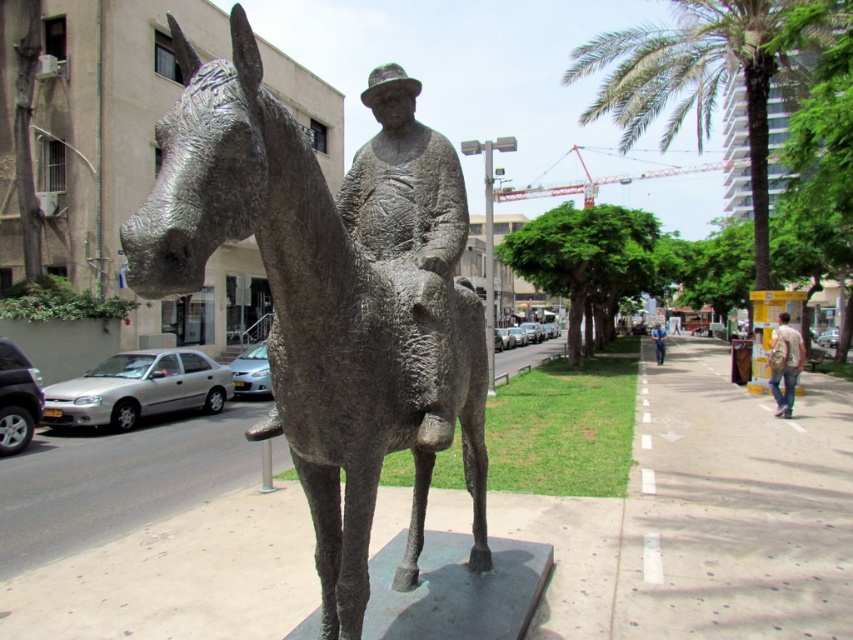
You are a city planner assessing the placement of the bronze statue at center and the concrete sidewalk at center. Based on the scene, is the statue placed on top of the sidewalk or beside it?

The bronze statue at center is positioned over concrete sidewalk at center, so it is placed on top of the sidewalk.

You are standing in the urban area and see the bronze statue at center and the green leafy palm tree at upper right. Which object is positioned to the left of the other?

The bronze statue at center is positioned to the left of the green leafy palm tree at upper right.

You are a delivery person with a cart that is 1.8 meters wide. You want to pass between the two points marked as point (260, 195). Can your cart fit through the space between them?

The distance between the two points marked as point (260, 195) is 1.90 meters. Since your cart is 1.8 meters wide, it can fit through the space as the distance is slightly larger than the cart width.